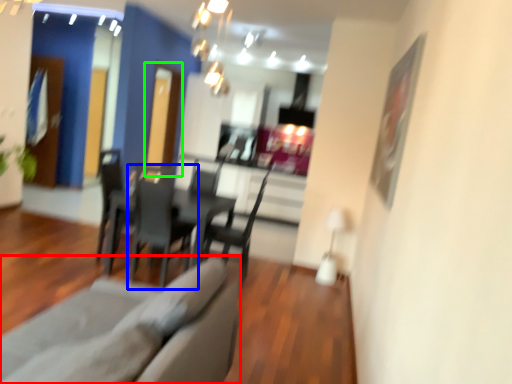
Question: Estimate the real-world distances between objects in this image. Which object is farther from couch (highlighted by a red box), chair (highlighted by a blue box) or glass door (highlighted by a green box)?

Choices:
 (A) chair
 (B) glass door

Answer: (B)